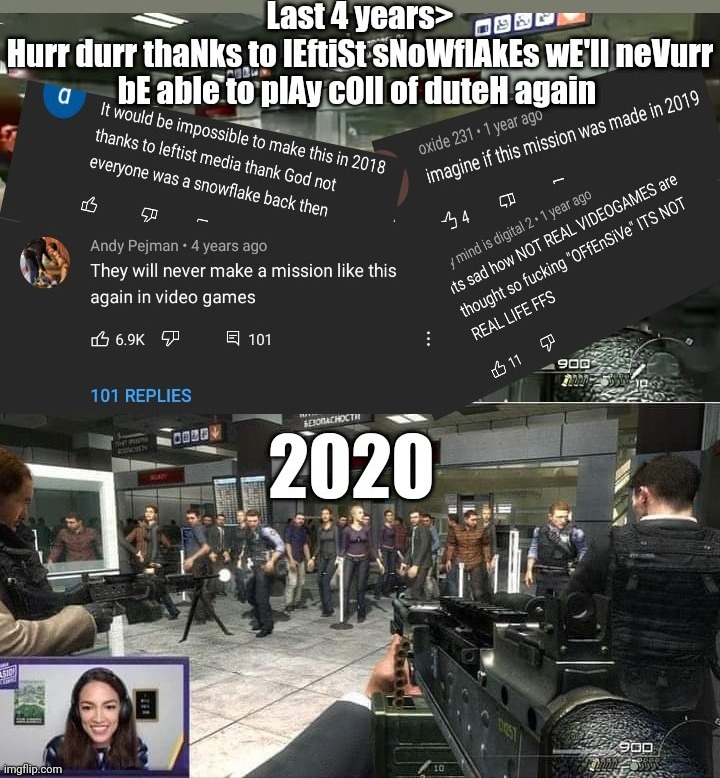
Find the location of a particular element. The image size is (720, 778). tile floor is located at coordinates (271, 687).